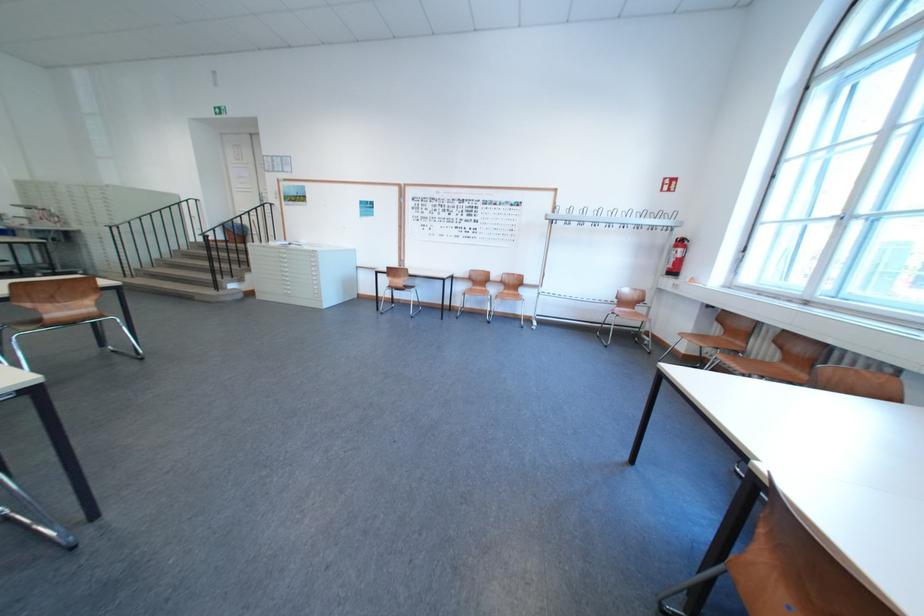
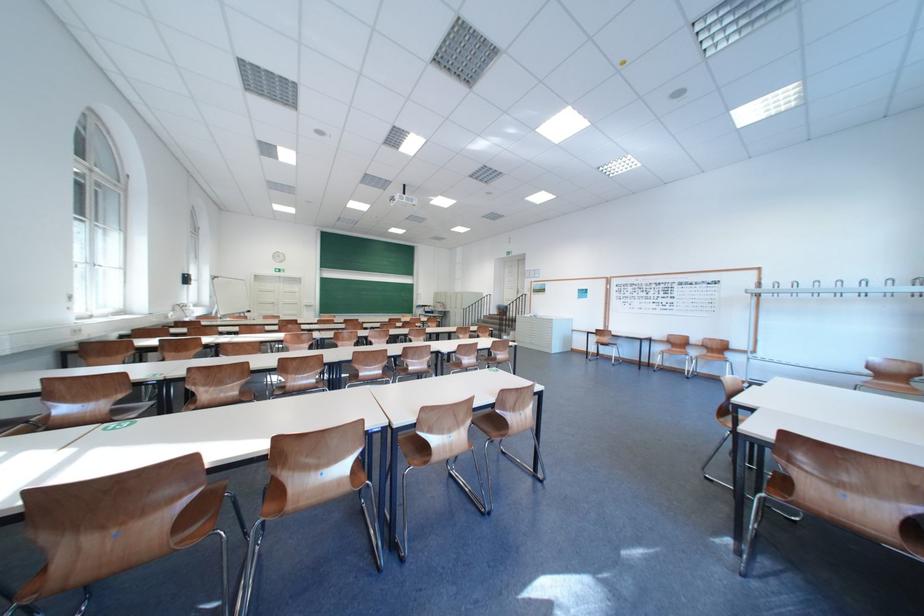
The point at (563, 214) is marked in the first image. Where is the corresponding point in the second image?

(767, 288)